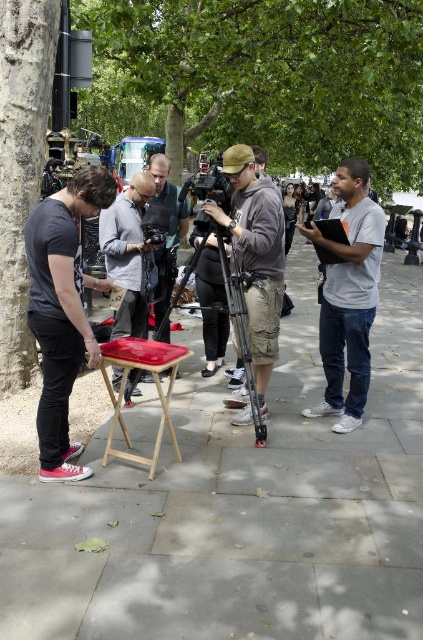
Can you confirm if matte black shirt at left is positioned above matte black camera at center?

Actually, matte black shirt at left is below matte black camera at center.

Does point (35, 285) come in front of point (164, 195)?

Yes.

Where is `matte black shirt at left`? matte black shirt at left is located at coordinates (63, 310).

The width and height of the screenshot is (423, 640). What do you see at coordinates (241, 508) in the screenshot?
I see `wooden stool at center` at bounding box center [241, 508].

Does wooden stool at center have a greater width compared to smooth bark tree at left?

No.

At what (x,y) coordinates should I click in order to perform the action: click on wooden stool at center. Please return your answer as a coordinate pair (x, y). Looking at the image, I should click on (241, 508).

Between point (206, 68) and point (159, 241), which one is positioned in front?

Point (159, 241)

Is green leafy tree at upper center below black plastic video camera at center?

No, green leafy tree at upper center is not below black plastic video camera at center.

Does point (101, 3) come farther from viewer compared to point (145, 230)?

Yes.

This screenshot has height=640, width=423. In order to click on green leafy tree at upper center in this screenshot , I will do `click(274, 76)`.